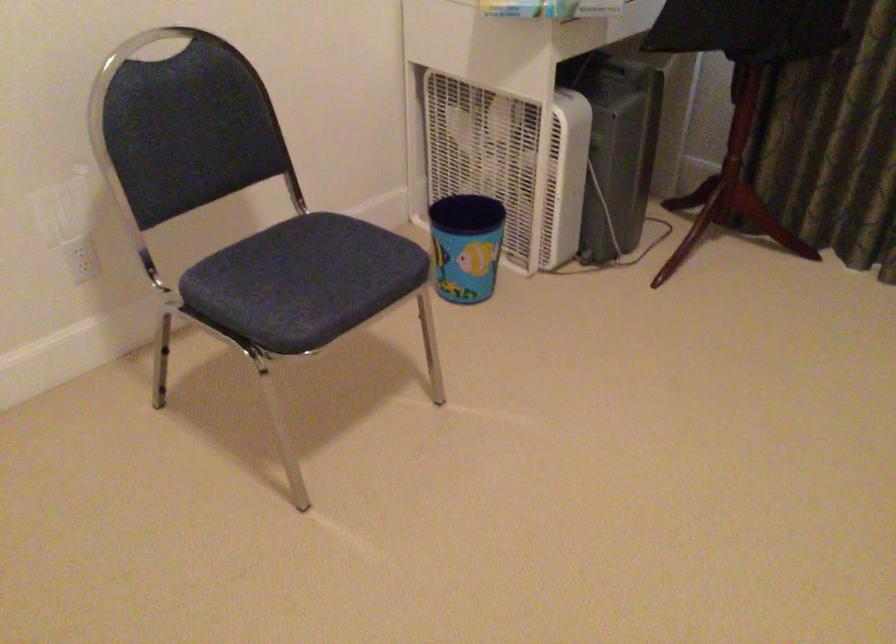
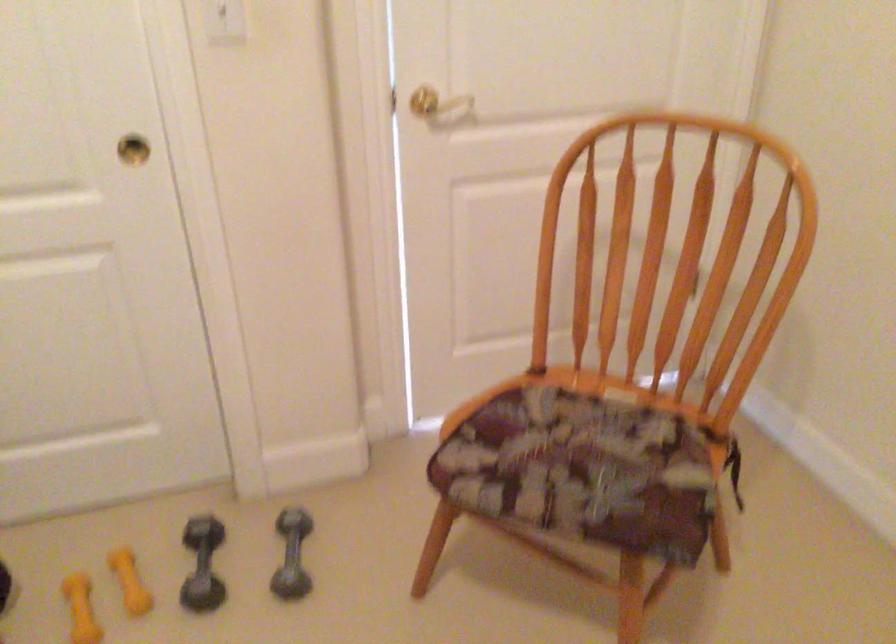
The first image is from the beginning of the video and the second image is from the end. How did the camera likely rotate when shooting the video?

The camera's rotation is toward left-down.